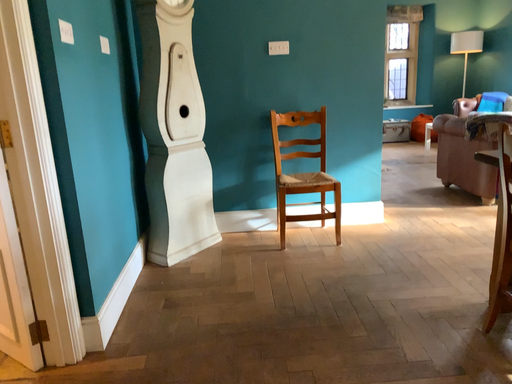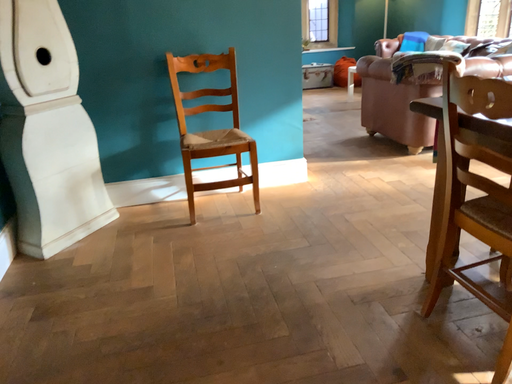
Question: Which way did the camera rotate in the video?

Choices:
 (A) rotated upward
 (B) rotated downward

Answer: (B)